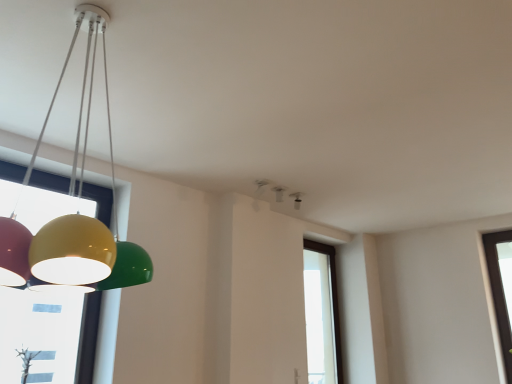
What do you see at coordinates (75, 216) in the screenshot? I see `glossy plastic lamp at left, which appears as the third lamp when viewed from the right` at bounding box center [75, 216].

In order to face glossy plastic lamp at left, arranged as the 1th lamp when viewed from the front, should I rotate leftwards or rightwards?

You should look left and rotate roughly 21.863 degrees.

The width and height of the screenshot is (512, 384). I want to click on matte black speaker at upper center, the 3th lamp in the front-to-back sequence, so 297,199.

Considering the relative sizes of transparent glass window at center and glossy plastic lamp at left, which appears as the third lamp when viewed from the right, in the image provided, is transparent glass window at center taller than glossy plastic lamp at left, which appears as the third lamp when viewed from the right,?

Correct, transparent glass window at center is much taller as glossy plastic lamp at left, which appears as the third lamp when viewed from the right.

Is transparent glass window at center surrounding glossy plastic lamp at left, which appears as the third lamp when viewed from the right?

No, glossy plastic lamp at left, which appears as the third lamp when viewed from the right, is not inside transparent glass window at center.

Which object is closer to the camera taking this photo, transparent glass window at center or glossy plastic lamp at left, which appears as the third lamp when viewed from the right?

glossy plastic lamp at left, which appears as the third lamp when viewed from the right.

Where is `window below the glossy plastic lamp at left, the first lamp viewed from the left (from a real-world perspective)`? This screenshot has width=512, height=384. window below the glossy plastic lamp at left, the first lamp viewed from the left (from a real-world perspective) is located at coordinates (321, 314).

Locate an element on the screen. This screenshot has width=512, height=384. the 1st lamp in front of the matte black speaker at upper center, the 3th lamp when ordered from left to right, counting from the anchor's position is located at coordinates (279, 193).

Is matte black speaker at upper center, the 1th lamp positioned from the back, far away from white plastic smoke detector at upper center, which ranks as the 2th lamp in left-to-right order?

matte black speaker at upper center, the 1th lamp positioned from the back, is actually quite close to white plastic smoke detector at upper center, which ranks as the 2th lamp in left-to-right order.

Who is smaller, matte black speaker at upper center, the 3th lamp in the front-to-back sequence, or white plastic smoke detector at upper center, which appears as the 2th lamp when viewed from the front?

With smaller size is matte black speaker at upper center, the 3th lamp in the front-to-back sequence.

From a real-world perspective, is matte black speaker at upper center, the 1th lamp positioned from the back, located higher than white plastic smoke detector at upper center, marked as the second lamp in a right-to-left arrangement?

Actually, matte black speaker at upper center, the 1th lamp positioned from the back, is physically below white plastic smoke detector at upper center, marked as the second lamp in a right-to-left arrangement, in the real world.

From the image's perspective, which one is positioned lower, transparent glass window at center or white plastic smoke detector at upper center, which appears as the 2th lamp when viewed from the front?

transparent glass window at center appears lower in the image.

Is white plastic smoke detector at upper center, which appears as the 2th lamp when viewed from the front, a part of transparent glass window at center?

Actually, white plastic smoke detector at upper center, which appears as the 2th lamp when viewed from the front, is outside transparent glass window at center.

Does transparent glass window at center turn towards white plastic smoke detector at upper center, arranged as the 2th lamp when viewed from the back?

No, transparent glass window at center is not oriented towards white plastic smoke detector at upper center, arranged as the 2th lamp when viewed from the back.

From a real-world perspective, is transparent glass window at center positioned above or below white plastic smoke detector at upper center, arranged as the 2th lamp when viewed from the back?

In terms of real-world spatial position, transparent glass window at center is below white plastic smoke detector at upper center, arranged as the 2th lamp when viewed from the back.

Can you tell me how much glossy plastic lamp at left, arranged as the 1th lamp when viewed from the front, and white plastic smoke detector at upper center, arranged as the 2th lamp when viewed from the back, differ in facing direction?

They differ by 3.41 degrees in their facing directions.

Which point is more forward, [49,235] or [277,201]?

Positioned in front is point [49,235].

Choose the correct answer: Is glossy plastic lamp at left, arranged as the 1th lamp when viewed from the front, inside white plastic smoke detector at upper center, which ranks as the 2th lamp in left-to-right order, or outside it?

glossy plastic lamp at left, arranged as the 1th lamp when viewed from the front, is located beyond the bounds of white plastic smoke detector at upper center, which ranks as the 2th lamp in left-to-right order.

Between glossy plastic lamp at left, which appears as the third lamp when viewed from the right, and white plastic smoke detector at upper center, which ranks as the 2th lamp in left-to-right order, which one has less height?

Standing shorter between the two is white plastic smoke detector at upper center, which ranks as the 2th lamp in left-to-right order.

Is matte black speaker at upper center, the 3th lamp when ordered from left to right, inside the boundaries of transparent glass window at center, or outside?

matte black speaker at upper center, the 3th lamp when ordered from left to right, is not inside transparent glass window at center, it's outside.

Which of these two, matte black speaker at upper center, the 3th lamp in the front-to-back sequence, or transparent glass window at center, stands shorter?

Standing shorter between the two is matte black speaker at upper center, the 3th lamp in the front-to-back sequence.

From the image's perspective, is matte black speaker at upper center, the 3th lamp when ordered from left to right, located above transparent glass window at center?

Yes, from the image's perspective, matte black speaker at upper center, the 3th lamp when ordered from left to right, is over transparent glass window at center.

Is matte black speaker at upper center, the 3th lamp in the front-to-back sequence, positioned with its back to transparent glass window at center?

matte black speaker at upper center, the 3th lamp in the front-to-back sequence, does not have its back to transparent glass window at center.

What's the angular difference between glossy plastic lamp at left, placed as the 3th lamp when sorted from back to front, and matte black speaker at upper center, the 1th lamp positioned from the back,'s facing directions?

They differ by 2.34 degrees in their facing directions.

From a real-world perspective, which object stands above the other?

In real-world perspective, matte black speaker at upper center, the 3th lamp in the front-to-back sequence, is above.

From the image's perspective, is glossy plastic lamp at left, which appears as the third lamp when viewed from the right, over matte black speaker at upper center, the 3th lamp when ordered from left to right?

Indeed, from the image's perspective, glossy plastic lamp at left, which appears as the third lamp when viewed from the right, is shown above matte black speaker at upper center, the 3th lamp when ordered from left to right.

Would you consider glossy plastic lamp at left, the first lamp viewed from the left, to be distant from matte black speaker at upper center, the 3th lamp in the front-to-back sequence?

Yes, glossy plastic lamp at left, the first lamp viewed from the left, is far from matte black speaker at upper center, the 3th lamp in the front-to-back sequence.

Does matte black speaker at upper center, the 3th lamp in the front-to-back sequence, have a larger size compared to glossy plastic lamp at left, which appears as the third lamp when viewed from the right?

Incorrect, matte black speaker at upper center, the 3th lamp in the front-to-back sequence, is not larger than glossy plastic lamp at left, which appears as the third lamp when viewed from the right.

Between matte black speaker at upper center, the 1th lamp positioned from the back, and glossy plastic lamp at left, the first lamp viewed from the left, which one has less height?

Standing shorter between the two is matte black speaker at upper center, the 1th lamp positioned from the back.

Is matte black speaker at upper center, the 3th lamp in the front-to-back sequence, in contact with glossy plastic lamp at left, placed as the 3th lamp when sorted from back to front?

No, matte black speaker at upper center, the 3th lamp in the front-to-back sequence, is not in contact with glossy plastic lamp at left, placed as the 3th lamp when sorted from back to front.

Identify the location of window that appears below the glossy plastic lamp at left, the first lamp viewed from the left (from the image's perspective). This screenshot has width=512, height=384. (321, 314).

The height and width of the screenshot is (384, 512). In order to click on the 1st lamp counting from the left side of the matte black speaker at upper center, the 3th lamp in the front-to-back sequence in this screenshot , I will do `click(279, 193)`.

Looking at the image, which one is located further to transparent glass window at center, matte black speaker at upper center, placed as the 1th lamp when sorted from right to left, or glossy plastic lamp at left, the first lamp viewed from the left?

glossy plastic lamp at left, the first lamp viewed from the left, is further to transparent glass window at center.

Looking at this image, looking at the image, which one is located closer to transparent glass window at center, white plastic smoke detector at upper center, which ranks as the 2th lamp in left-to-right order, or glossy plastic lamp at left, placed as the 3th lamp when sorted from back to front?

Among the two, white plastic smoke detector at upper center, which ranks as the 2th lamp in left-to-right order, is located nearer to transparent glass window at center.

Based on their spatial positions, is matte black speaker at upper center, the 3th lamp in the front-to-back sequence, or white plastic smoke detector at upper center, arranged as the 2th lamp when viewed from the back, closer to transparent glass window at center?

matte black speaker at upper center, the 3th lamp in the front-to-back sequence, is positioned closer to the anchor transparent glass window at center.

Estimate the real-world distances between objects in this image. Which object is closer to glossy plastic lamp at left, which appears as the third lamp when viewed from the right, matte black speaker at upper center, the 1th lamp positioned from the back, or transparent glass window at center?

matte black speaker at upper center, the 1th lamp positioned from the back.

Looking at this image, looking at the image, which one is located closer to glossy plastic lamp at left, arranged as the 1th lamp when viewed from the front, transparent glass window at center or matte black speaker at upper center, placed as the 1th lamp when sorted from right to left?

matte black speaker at upper center, placed as the 1th lamp when sorted from right to left.

Which object lies nearer to the anchor point glossy plastic lamp at left, the first lamp viewed from the left, white plastic smoke detector at upper center, arranged as the 2th lamp when viewed from the back, or transparent glass window at center?

The object closer to glossy plastic lamp at left, the first lamp viewed from the left, is white plastic smoke detector at upper center, arranged as the 2th lamp when viewed from the back.

Considering their positions, is glossy plastic lamp at left, the first lamp viewed from the left, positioned further to matte black speaker at upper center, the 3th lamp in the front-to-back sequence, than transparent glass window at center?

Based on the image, glossy plastic lamp at left, the first lamp viewed from the left, appears to be further to matte black speaker at upper center, the 3th lamp in the front-to-back sequence.

Based on the photo, considering their positions, is glossy plastic lamp at left, the first lamp viewed from the left, positioned closer to white plastic smoke detector at upper center, marked as the second lamp in a right-to-left arrangement, than transparent glass window at center?

transparent glass window at center is closer to white plastic smoke detector at upper center, marked as the second lamp in a right-to-left arrangement.

This screenshot has width=512, height=384. Identify the location of lamp positioned between glossy plastic lamp at left, which appears as the third lamp when viewed from the right, and matte black speaker at upper center, the 1th lamp positioned from the back, from near to far. (279, 193).

Find the location of a particular element. This screenshot has height=384, width=512. lamp that lies between white plastic smoke detector at upper center, marked as the second lamp in a right-to-left arrangement, and transparent glass window at center from top to bottom is located at coordinates (297, 199).